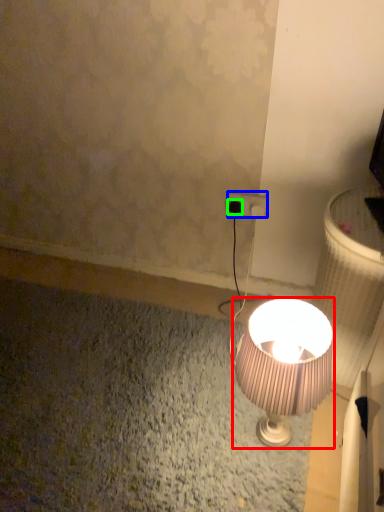
Question: Based on their relative distances, which object is nearer to lamp (highlighted by a red box)? Choose from power plugs and sockets (highlighted by a blue box) and plug (highlighted by a green box).

Choices:
 (A) power plugs and sockets
 (B) plug

Answer: (A)